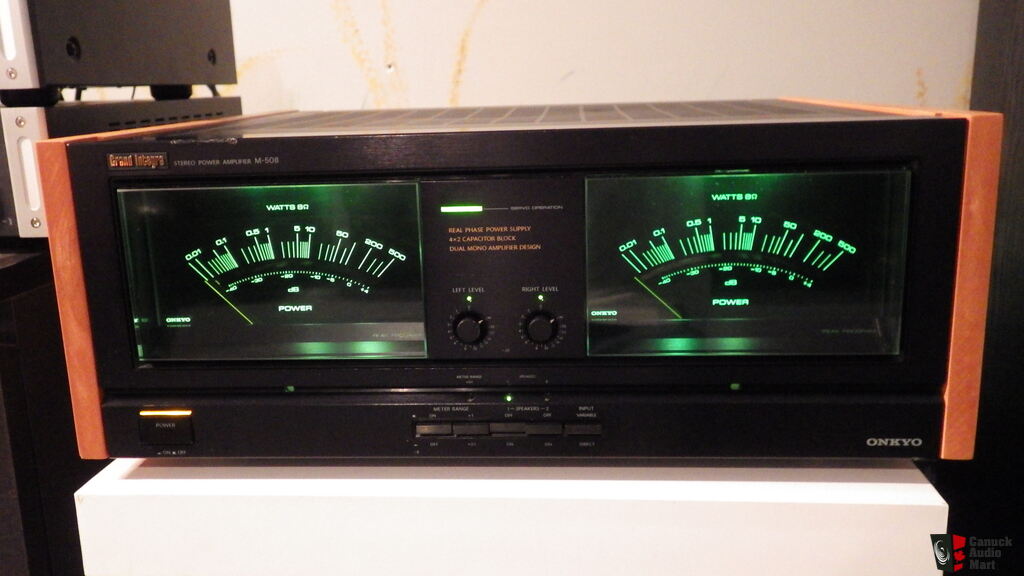
At what (x,y) coordinates should I click in order to perform the action: click on top of white cabinet. Please return your answer as a coordinate pair (x, y). The image size is (1024, 576). Looking at the image, I should click on (559, 484).